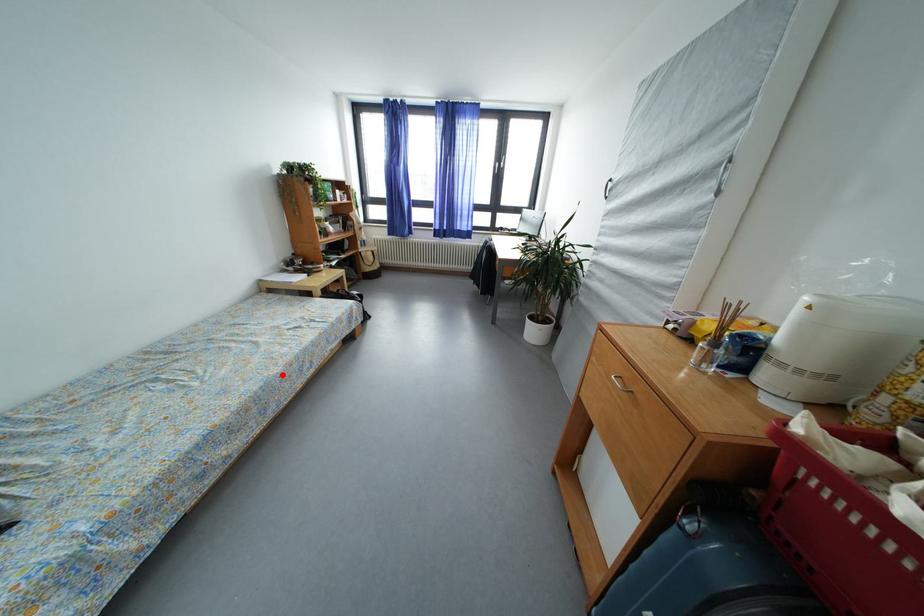
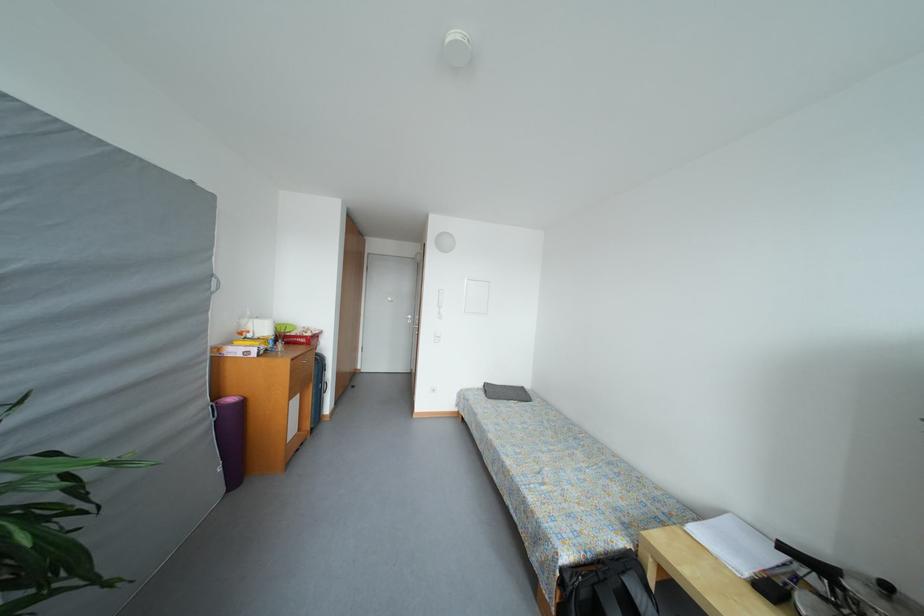
The point at the highlighted location is marked in the first image. Where is the corresponding point in the second image?

(496, 440)